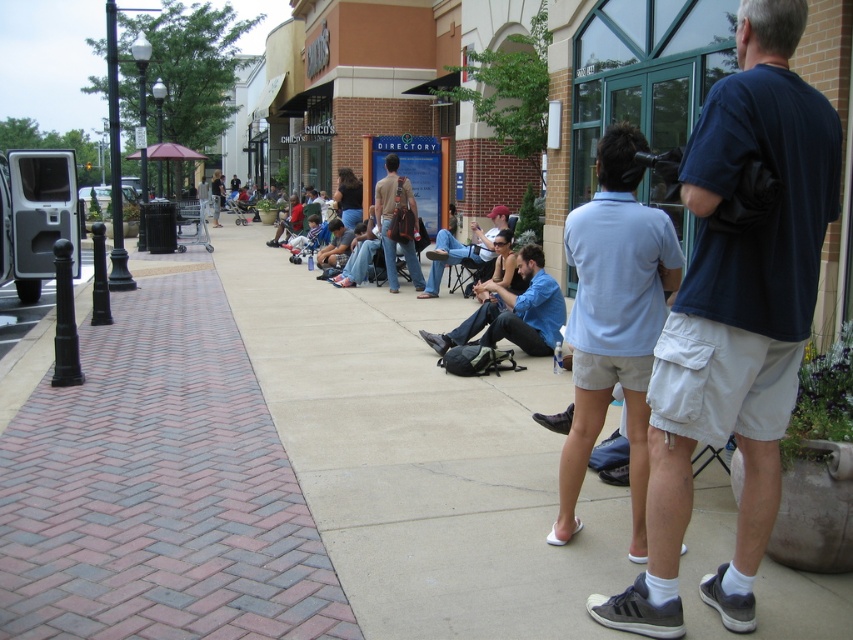
You are a photographer standing at the edge of the walkway. You notice the light blue shirt at center and the blue denim jeans at center in your viewfinder. Based on their positions, which one is closer to the ground?

The light blue shirt at center is positioned under blue denim jeans at center, so the light blue shirt at center is closer to the ground.